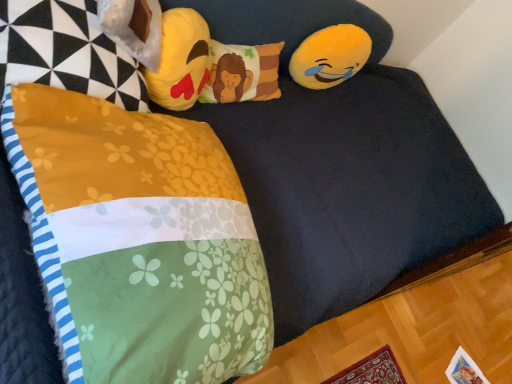
Where is `vacant space situated above soft yellow plush emoji at upper center, the second toy when ordered from back to front (from a real-world perspective)`? vacant space situated above soft yellow plush emoji at upper center, the second toy when ordered from back to front (from a real-world perspective) is located at coordinates (181, 33).